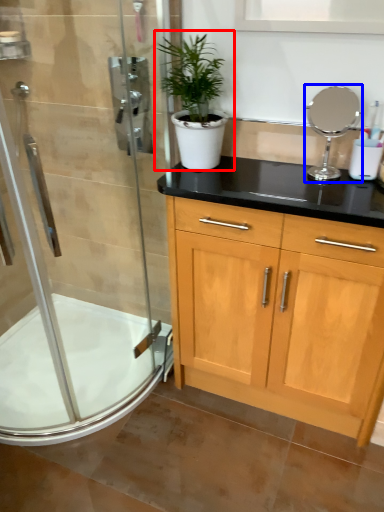
Question: Which point is closer to the camera, houseplant (highlighted by a red box) or mirror (highlighted by a blue box)?

Choices:
 (A) houseplant
 (B) mirror

Answer: (A)